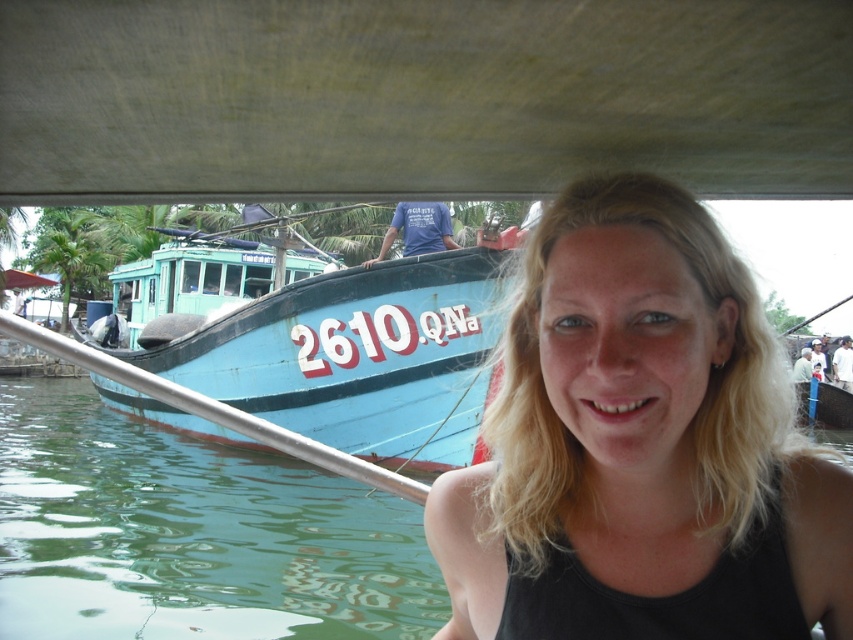
Question: Is blonde hair at center wider than blue matte boat at left?

Choices:
 (A) no
 (B) yes

Answer: (A)

Question: From the image, what is the correct spatial relationship of blonde hair at center in relation to blue matte boat at left?

Choices:
 (A) above
 (B) below

Answer: (B)

Question: Does blonde hair at center appear over blue matte boat at left?

Choices:
 (A) yes
 (B) no

Answer: (B)